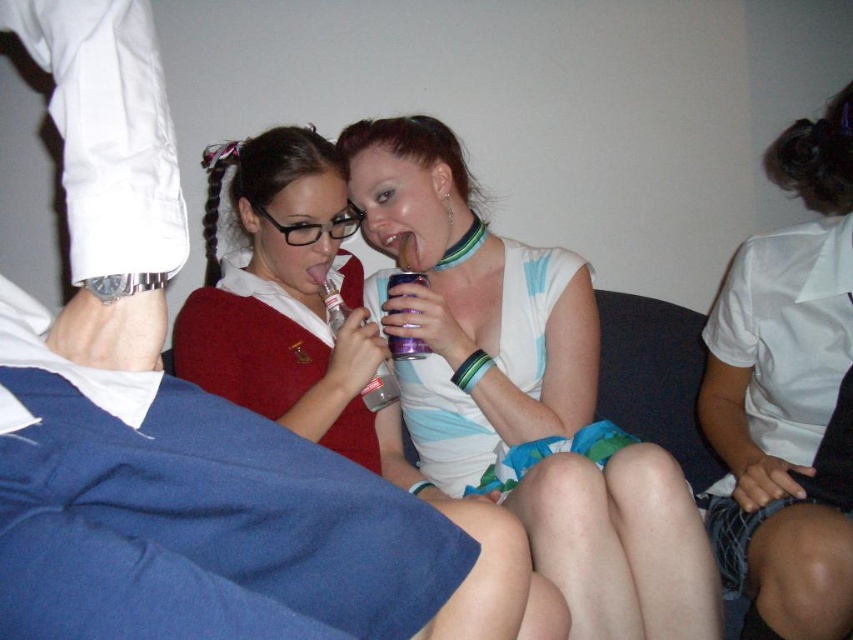
Who is higher up, matte plastic cup at center or white matte shirt at upper right?

Positioned higher is white matte shirt at upper right.

Between point (358, 204) and point (822, 448), which one is positioned behind?

Positioned behind is point (358, 204).

Measure the distance between matte plastic cup at center and camera.

They are 36.93 inches apart.

The height and width of the screenshot is (640, 853). I want to click on matte plastic cup at center, so click(526, 396).

Consider the image. Is white matte shirt at upper right smaller than matte white dress at center?

No, white matte shirt at upper right is not smaller than matte white dress at center.

Does white matte shirt at upper right appear over matte white dress at center?

Incorrect, white matte shirt at upper right is not positioned above matte white dress at center.

Which is behind, point (788, 408) or point (349, 214)?

Positioned behind is point (349, 214).

The width and height of the screenshot is (853, 640). In order to click on white matte shirt at upper right in this screenshot , I will do `click(786, 396)`.

Who is higher up, white matte shirt at upper right or purple metallic can at center?

purple metallic can at center is above.

Can you confirm if white matte shirt at upper right is positioned to the left of purple metallic can at center?

Incorrect, white matte shirt at upper right is not on the left side of purple metallic can at center.

Does point (846, 273) lie behind point (405, 276)?

No, (846, 273) is in front of (405, 276).

This screenshot has width=853, height=640. I want to click on white matte shirt at upper right, so click(x=786, y=396).